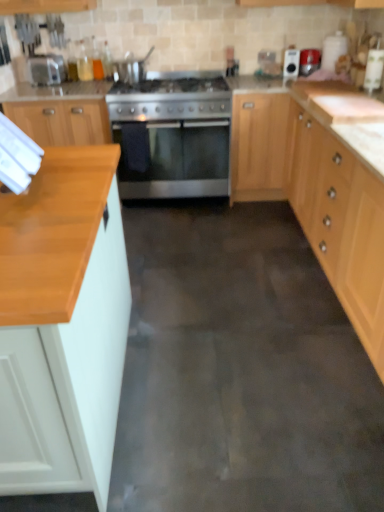
Question: Could you tell me if wooden countertop at left, which is counted as the second cabinetry, starting from the right, is turned towards stainless steel oven at center?

Choices:
 (A) yes
 (B) no

Answer: (A)

Question: Is wooden countertop at left, placed as the 1th cabinetry when sorted from bottom to top, positioned before stainless steel oven at center?

Choices:
 (A) yes
 (B) no

Answer: (A)

Question: Is wooden countertop at left, which is counted as the second cabinetry, starting from the right, wider than stainless steel oven at center?

Choices:
 (A) yes
 (B) no

Answer: (A)

Question: Does wooden countertop at left, placed as the 1th cabinetry when sorted from bottom to top, have a lesser height compared to stainless steel oven at center?

Choices:
 (A) no
 (B) yes

Answer: (A)

Question: Can you confirm if wooden countertop at left, the second cabinetry in the top-to-bottom sequence, is positioned to the right of stainless steel oven at center?

Choices:
 (A) yes
 (B) no

Answer: (B)

Question: Is wooden countertop at left, the second cabinetry in the top-to-bottom sequence, thinner than stainless steel oven at center?

Choices:
 (A) yes
 (B) no

Answer: (B)

Question: Is satin silver toaster at upper left bigger than metallic red toaster at upper right, the first appliance from the right?

Choices:
 (A) no
 (B) yes

Answer: (B)

Question: Is satin silver toaster at upper left shorter than metallic red toaster at upper right, positioned as the 3th appliance in left-to-right order?

Choices:
 (A) yes
 (B) no

Answer: (B)

Question: Considering the relative sizes of satin silver toaster at upper left and metallic red toaster at upper right, the first appliance from the right, in the image provided, is satin silver toaster at upper left taller than metallic red toaster at upper right, the first appliance from the right,?

Choices:
 (A) no
 (B) yes

Answer: (B)

Question: Is metallic red toaster at upper right, the first appliance from the right, located within satin silver toaster at upper left?

Choices:
 (A) no
 (B) yes

Answer: (A)

Question: Does satin silver toaster at upper left have a lesser width compared to metallic red toaster at upper right, positioned as the 3th appliance in left-to-right order?

Choices:
 (A) no
 (B) yes

Answer: (A)

Question: Considering the relative sizes of satin silver toaster at upper left and metallic red toaster at upper right, the first appliance from the right, in the image provided, is satin silver toaster at upper left wider than metallic red toaster at upper right, the first appliance from the right,?

Choices:
 (A) no
 (B) yes

Answer: (B)

Question: Does stainless steel gas stove at center have a smaller size compared to metallic red toaster at upper right, positioned as the 3th appliance in left-to-right order?

Choices:
 (A) no
 (B) yes

Answer: (A)